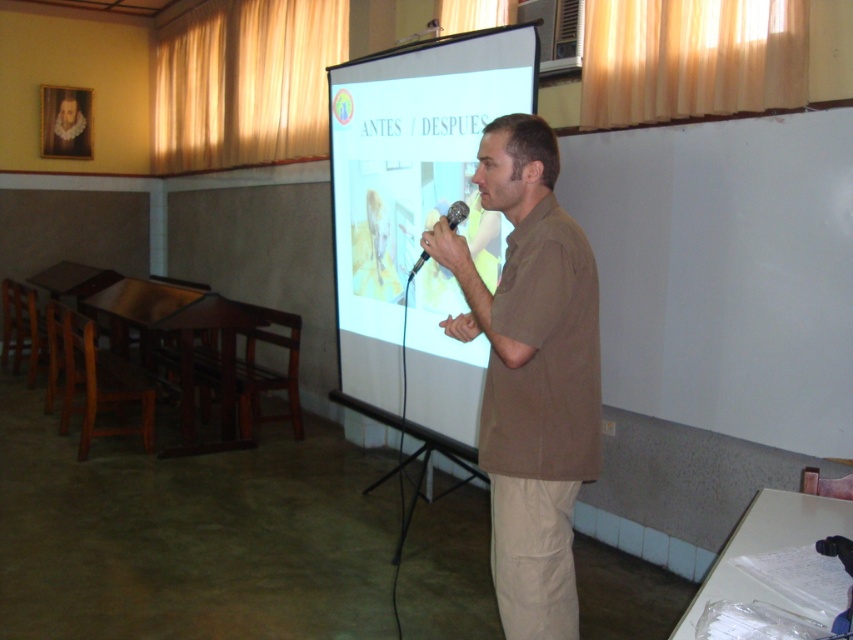
You are a speaker who needs to ensure that both the white matte projection screen at center and the black plastic microphone at center are visible to the audience. Considering their sizes, which object should you position closer to the audience to maintain visibility?

The black plastic microphone at center is smaller than the white matte projection screen at center. To ensure both are visible, position the microphone closer to the audience since it is smaller and needs to be nearer for clarity, while the larger screen can be farther away and still be seen.

You are a student sitting in the back row of the classroom. You want to see both the brown cotton shirt at center and the white matte projection screen at center clearly. Which one is easier to see from your current position?

The white matte projection screen at center is easier to see because it is positioned above the brown cotton shirt at center, making it more visible from a distance in the back row.

You are a stagehand who needs to adjust the distance between the brown cotton shirt at center and the white matte projection screen at center to exactly 1.5 meters. Currently, they are 1.33 meters apart. How much more space do you need to add?

The current distance between the brown cotton shirt at center and the white matte projection screen at center is 1.33 meters. To reach the desired 1.5 meters, you need to add an additional 0.17 meters of space between them.